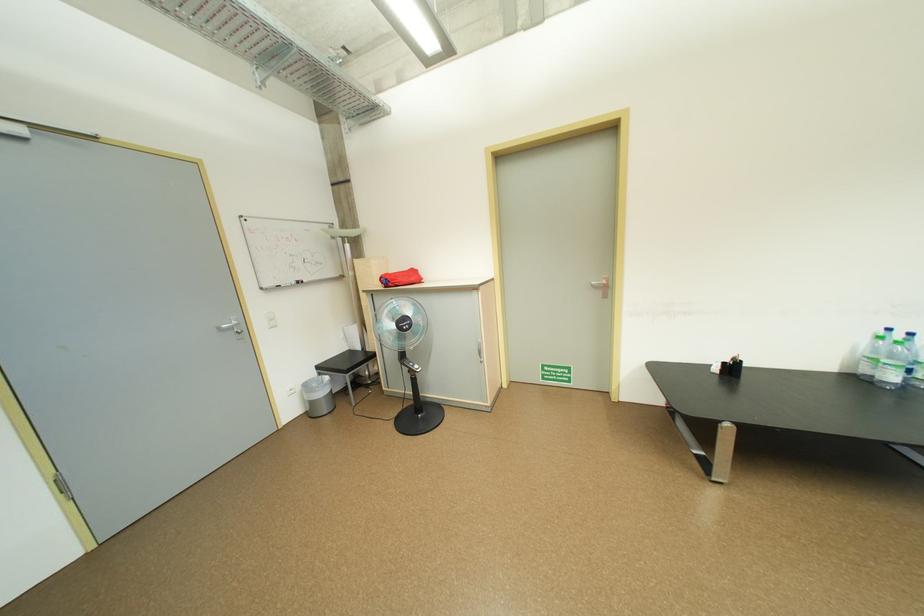
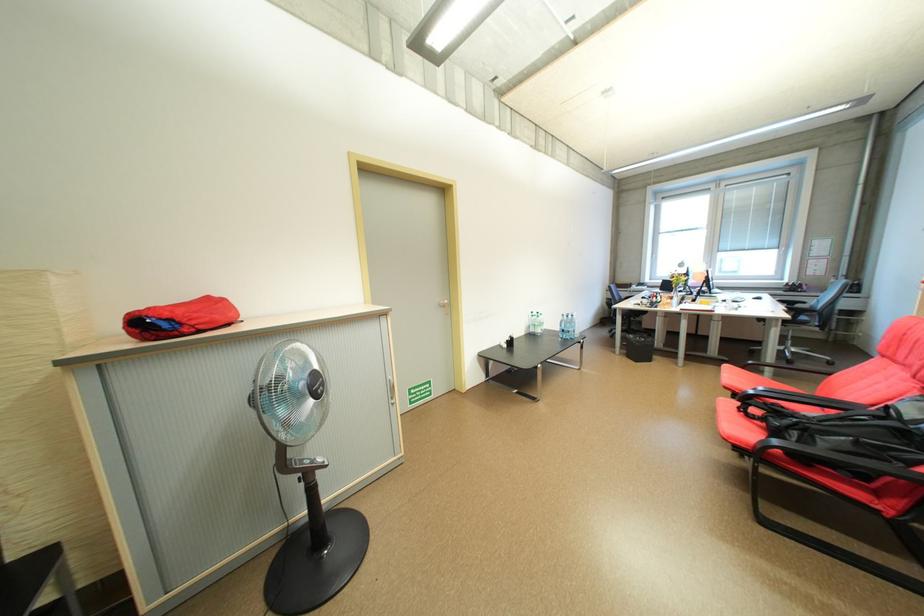
Where in the second image is the point corresponding to (873,370) from the first image?

(541, 331)